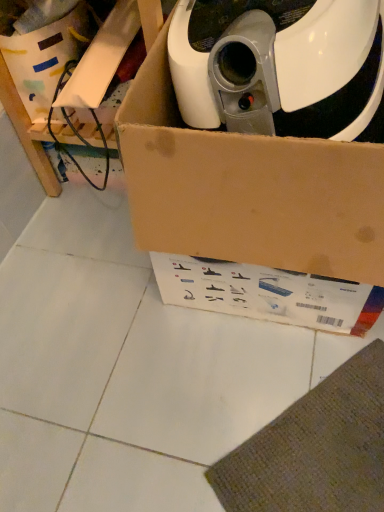
Question: Is there a large distance between white cardboard box at upper left and brown cardboard box at upper center?

Choices:
 (A) no
 (B) yes

Answer: (A)

Question: Is brown cardboard box at upper center inside white cardboard box at upper left?

Choices:
 (A) yes
 (B) no

Answer: (B)

Question: Can you confirm if white cardboard box at upper left is positioned to the left of brown cardboard box at upper center?

Choices:
 (A) yes
 (B) no

Answer: (A)

Question: Is white cardboard box at upper left wider than brown cardboard box at upper center?

Choices:
 (A) no
 (B) yes

Answer: (A)

Question: Is white cardboard box at upper left aimed at brown cardboard box at upper center?

Choices:
 (A) yes
 (B) no

Answer: (B)

Question: Considering the relative sizes of white cardboard box at upper left and brown cardboard box at upper center in the image provided, is white cardboard box at upper left shorter than brown cardboard box at upper center?

Choices:
 (A) no
 (B) yes

Answer: (B)

Question: Would you say brown cardboard box at upper center is a long distance from white cardboard box at upper left?

Choices:
 (A) no
 (B) yes

Answer: (A)

Question: From the image's perspective, does brown cardboard box at upper center appear higher than white cardboard box at upper left?

Choices:
 (A) no
 (B) yes

Answer: (A)

Question: Considering the relative sizes of brown cardboard box at upper center and white cardboard box at upper left in the image provided, is brown cardboard box at upper center bigger than white cardboard box at upper left?

Choices:
 (A) no
 (B) yes

Answer: (B)

Question: Is brown cardboard box at upper center positioned before white cardboard box at upper left?

Choices:
 (A) no
 (B) yes

Answer: (B)

Question: Is brown cardboard box at upper center smaller than white cardboard box at upper left?

Choices:
 (A) no
 (B) yes

Answer: (A)

Question: Could you tell me if brown cardboard box at upper center is turned towards white cardboard box at upper left?

Choices:
 (A) yes
 (B) no

Answer: (B)

Question: Is white cardboard box at upper left bigger than brown cardboard box at upper left?

Choices:
 (A) no
 (B) yes

Answer: (A)